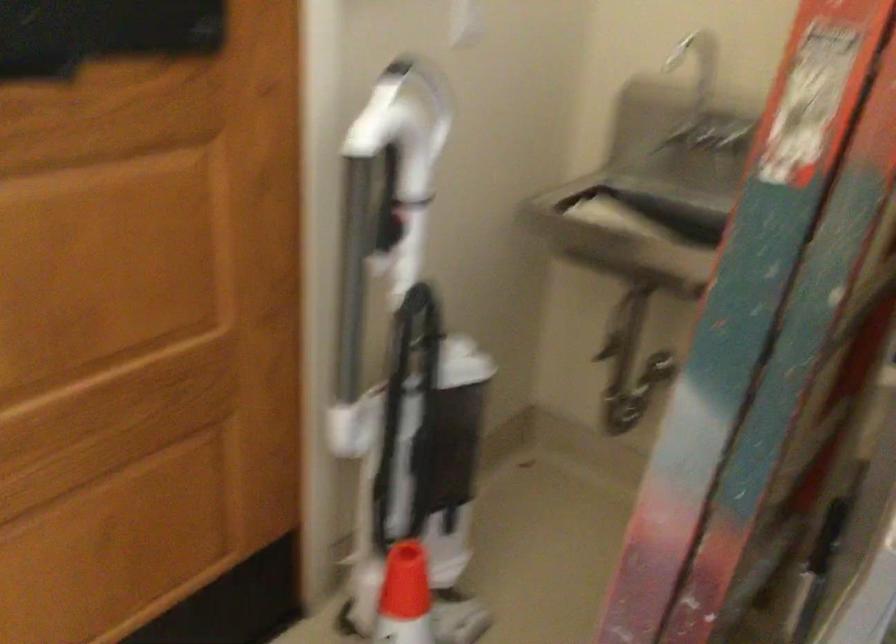
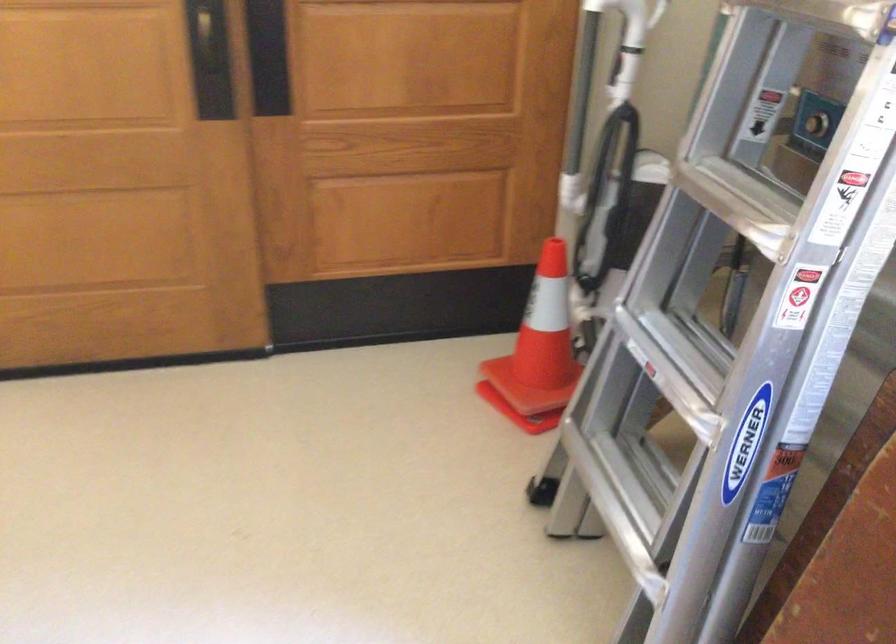
The point at (429, 165) is marked in the first image. Where is the corresponding point in the second image?

(630, 24)